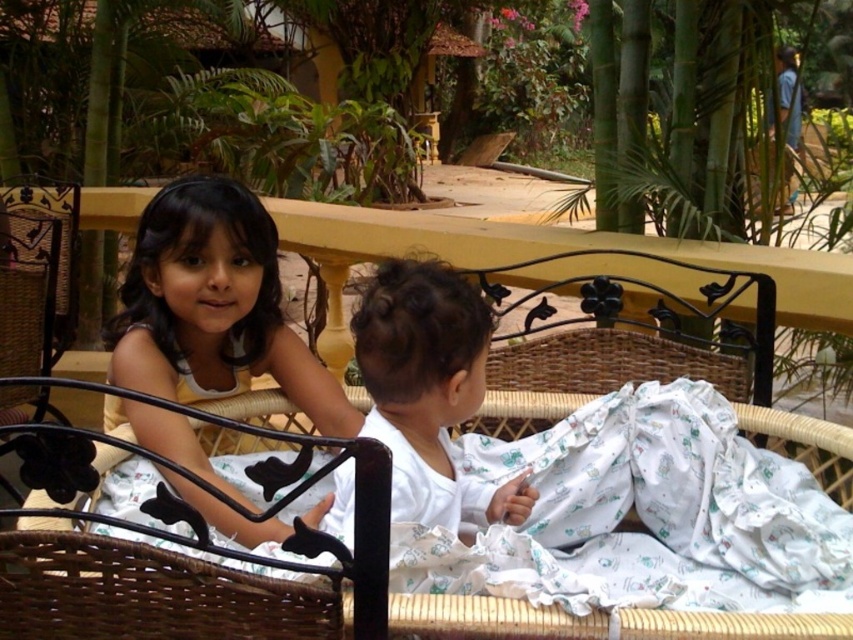
Question: Is the position of matte yellow dress at upper left more distant than that of white soft fabric at center?

Choices:
 (A) yes
 (B) no

Answer: (A)

Question: Can you confirm if matte yellow dress at upper left is positioned below white soft fabric at center?

Choices:
 (A) no
 (B) yes

Answer: (A)

Question: Which point appears closest to the camera in this image?

Choices:
 (A) (354, 337)
 (B) (335, 435)

Answer: (A)

Question: Can you confirm if matte yellow dress at upper left is smaller than white soft fabric at center?

Choices:
 (A) no
 (B) yes

Answer: (A)